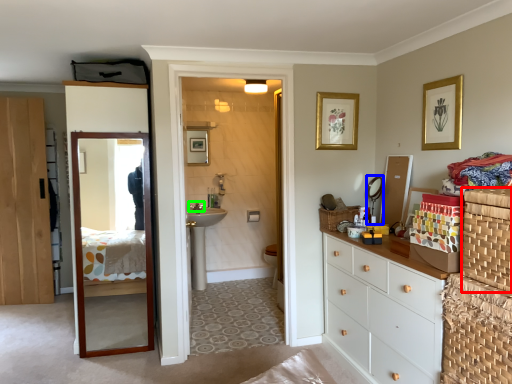
Question: Considering the real-world distances, which object is closest to basket container (highlighted by a red box)? mirror (highlighted by a blue box) or faucet (highlighted by a green box).

Choices:
 (A) mirror
 (B) faucet

Answer: (A)